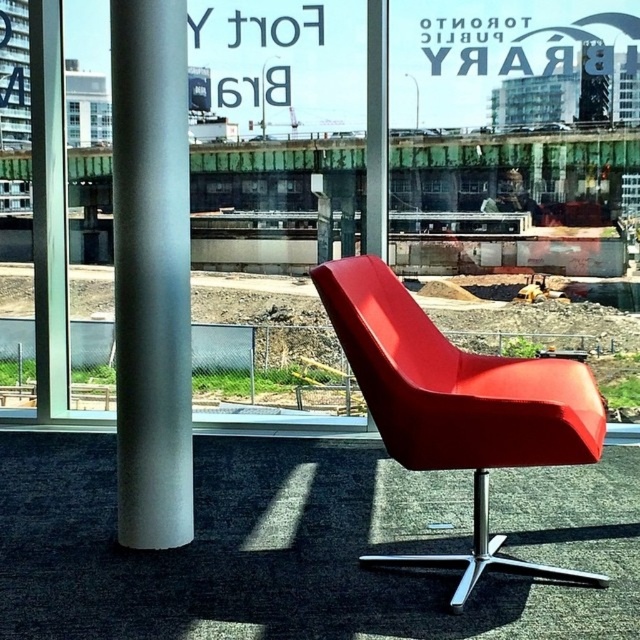
Question: Which point appears farthest from the camera in this image?

Choices:
 (A) (435, 464)
 (B) (124, 246)

Answer: (B)

Question: Which object is closer to the camera taking this photo?

Choices:
 (A) satin silver pole at left
 (B) matte red swivel chair at center

Answer: (B)

Question: Does satin silver pole at left appear on the left side of matte red swivel chair at center?

Choices:
 (A) yes
 (B) no

Answer: (A)

Question: Can you confirm if satin silver pole at left is bigger than matte red swivel chair at center?

Choices:
 (A) yes
 (B) no

Answer: (B)

Question: Can you confirm if satin silver pole at left is bigger than matte red swivel chair at center?

Choices:
 (A) no
 (B) yes

Answer: (A)